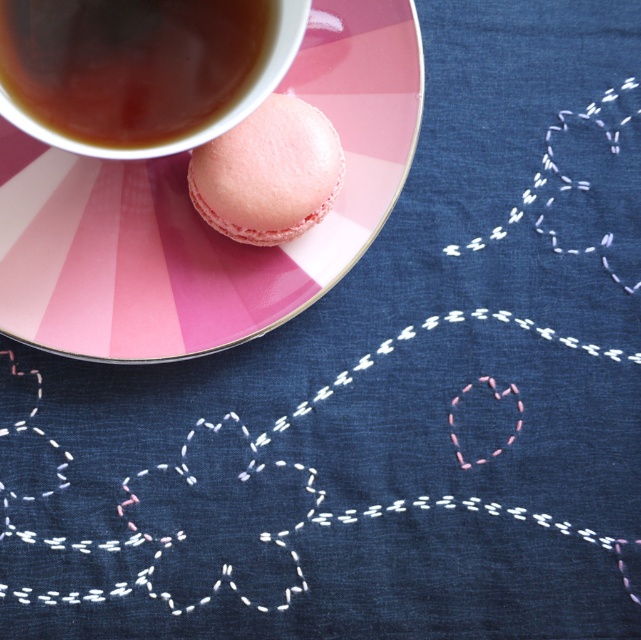
Who is higher up, pink glossy macaron at upper left or pink matte macaron at center?

pink glossy macaron at upper left is higher up.

Is pink glossy macaron at upper left to the left of pink matte macaron at center from the viewer's perspective?

Correct, you'll find pink glossy macaron at upper left to the left of pink matte macaron at center.

You are a GUI agent. You are given a task and a screenshot of the screen. Output one action in this format:
    pyautogui.click(x=<x>, y=<y>)
    Task: Click on the pink glossy macaron at upper left
    The width and height of the screenshot is (641, 640).
    Given the screenshot: What is the action you would take?
    pyautogui.click(x=197, y=216)

In the scene shown: Is pink glossy macaron at upper left wider than dark brown liquid at upper left?

Indeed, pink glossy macaron at upper left has a greater width compared to dark brown liquid at upper left.

Does pink glossy macaron at upper left have a greater height compared to dark brown liquid at upper left?

Indeed, pink glossy macaron at upper left has a greater height compared to dark brown liquid at upper left.

You are a GUI agent. You are given a task and a screenshot of the screen. Output one action in this format:
    pyautogui.click(x=<x>, y=<y>)
    Task: Click on the pink glossy macaron at upper left
    
    Given the screenshot: What is the action you would take?
    pyautogui.click(x=197, y=216)

Find the location of a particular element. The image size is (641, 640). pink glossy macaron at upper left is located at coordinates (197, 216).

From the picture: Which of these two, dark brown liquid at upper left or pink matte macaron at center, stands shorter?

With less height is dark brown liquid at upper left.

Based on the photo, which is above, dark brown liquid at upper left or pink matte macaron at center?

dark brown liquid at upper left is higher up.

The image size is (641, 640). What do you see at coordinates (129, 64) in the screenshot? I see `dark brown liquid at upper left` at bounding box center [129, 64].

You are a GUI agent. You are given a task and a screenshot of the screen. Output one action in this format:
    pyautogui.click(x=<x>, y=<y>)
    Task: Click on the dark brown liquid at upper left
    
    Given the screenshot: What is the action you would take?
    pyautogui.click(x=129, y=64)